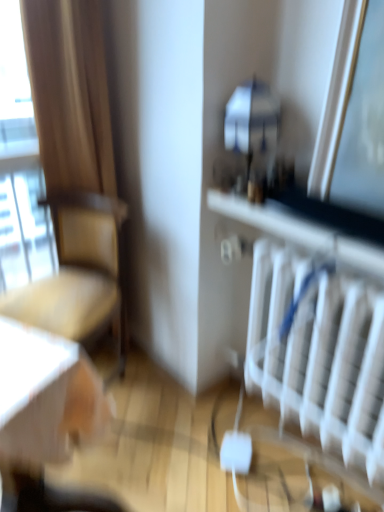
Question: Considering the positions of white plastic radiator at lower right and transparent glass window at left in the image, is white plastic radiator at lower right taller or shorter than transparent glass window at left?

Choices:
 (A) tall
 (B) short

Answer: (B)

Question: Looking at their shapes, would you say white plastic radiator at lower right is wider or thinner than transparent glass window at left?

Choices:
 (A) wide
 (B) thin

Answer: (A)

Question: Considering the real-world distances, which object is farthest from the transparent glass window at left?

Choices:
 (A) white plastic radiator at lower right
 (B) beige fabric chair at left

Answer: (A)

Question: Which of these objects is positioned farthest from the white plastic radiator at lower right?

Choices:
 (A) transparent glass window at left
 (B) beige fabric chair at left

Answer: (A)